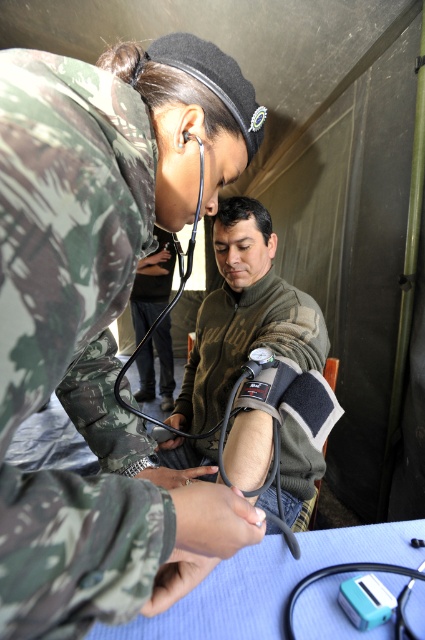
In the scene shown: You are a medical assistant in the scene. You need to determine which object is smaller between the camo uniform at center and the camouflage fabric blood pressure cuff at center. Which one is it?

The camo uniform at center is smaller compared to the camouflage fabric blood pressure cuff at center.

You are a photographer positioned at the camera. You want to take a photo that includes both the point at coordinates (138,396) and the point at (300,582). Which point will appear closer to the front of the photo?

The point at coordinates (138,396) will appear closer to the front of the photo because it is further to the camera than the point at (300,582).